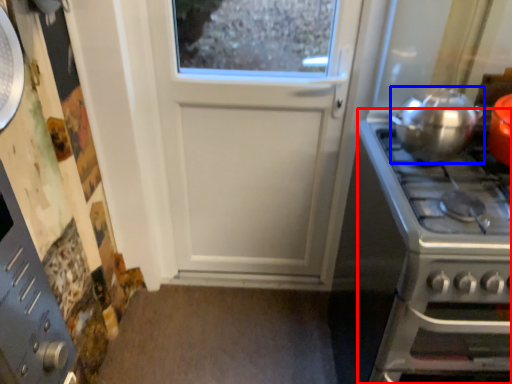
Question: Which of the following is the closest to the observer, gas stove (highlighted by a red box) or kitchen appliance (highlighted by a blue box)?

Choices:
 (A) gas stove
 (B) kitchen appliance

Answer: (A)